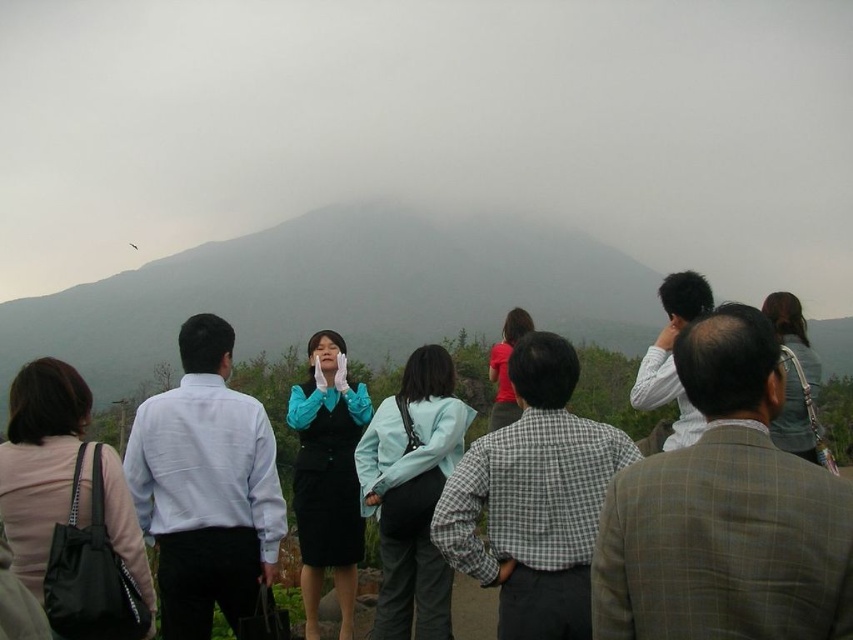
Looking at this image, is green mossy hill at center positioned in front of matte blue suit at center?

No, it is not.

Is point (280, 308) positioned in front of point (300, 538)?

No.

This screenshot has height=640, width=853. Find the location of `green mossy hill at center`. green mossy hill at center is located at coordinates (338, 292).

What do you see at coordinates (532, 499) in the screenshot? I see `light blue fabric shirt at center` at bounding box center [532, 499].

Is light blue fabric shirt at center below light blue fabric jacket at center?

Incorrect, light blue fabric shirt at center is not positioned below light blue fabric jacket at center.

Who is more forward, (518, 442) or (396, 531)?

Point (518, 442) is more forward.

Find the location of a particular element. Image resolution: width=853 pixels, height=640 pixels. light blue fabric shirt at center is located at coordinates (532, 499).

Can you confirm if light blue fabric shirt at center is positioned to the right of white smooth shirt at left?

Correct, you'll find light blue fabric shirt at center to the right of white smooth shirt at left.

Is point (622, 458) farther from viewer compared to point (253, 492)?

No, it is not.

The width and height of the screenshot is (853, 640). In order to click on light blue fabric shirt at center in this screenshot , I will do `click(532, 499)`.